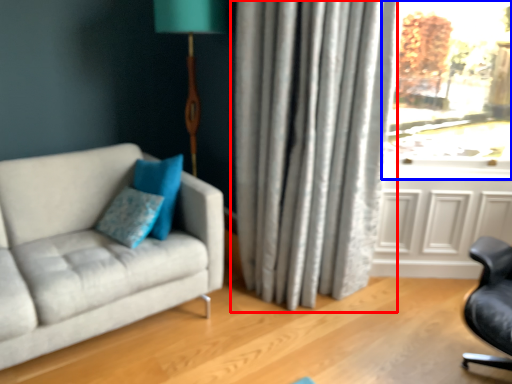
Question: Among these objects, which one is farthest to the camera, curtain (highlighted by a red box) or window (highlighted by a blue box)?

Choices:
 (A) curtain
 (B) window

Answer: (B)